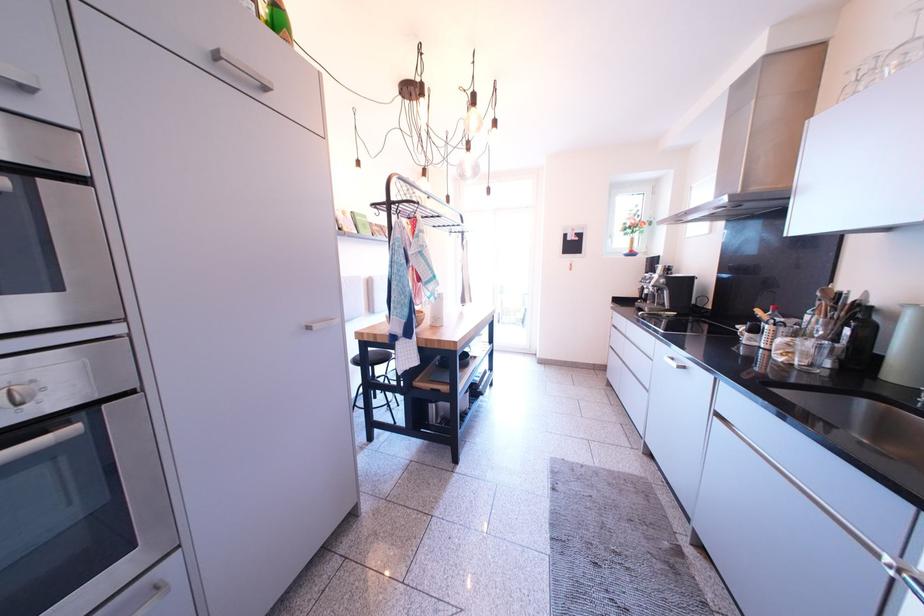
The image size is (924, 616). Find the location of `clear drinking glass`. clear drinking glass is located at coordinates (810, 354).